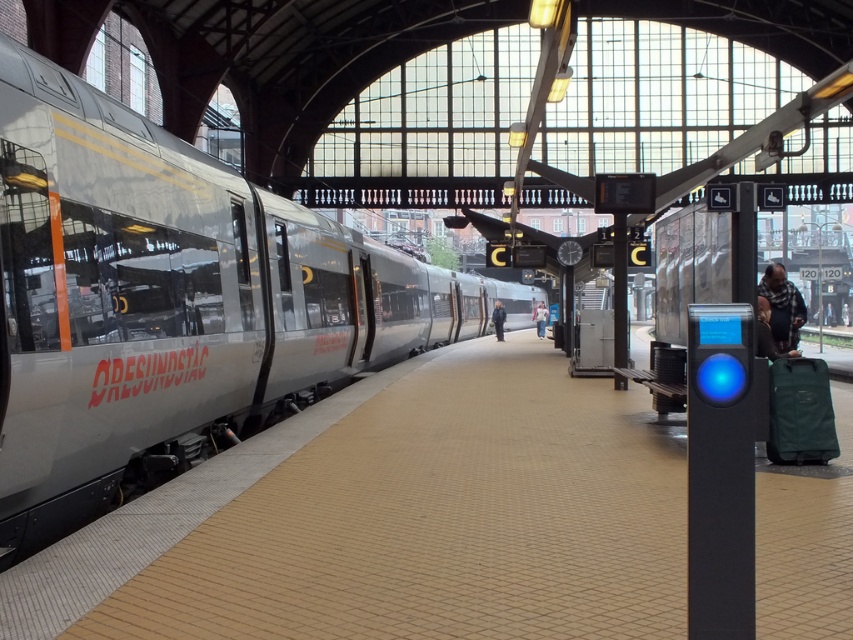
You are a passenger waiting on the train platform and notice two people wearing different colored clothing. The dark blue shirt at right and the light blue denim jacket at center. Which clothing item is positioned lower in the image?

The dark blue shirt at right is below the light blue denim jacket at center, so the dark blue shirt at right is positioned lower in the image.

You are a traveler waiting on the train station platform and notice two items nearby. You see the plaid fabric scarf at right and the light blue denim jacket at center. Which item is shorter in height?

The plaid fabric scarf at right has a lesser height compared to the light blue denim jacket at center, so the plaid fabric scarf at right is shorter in height.

Consider the image. You are a passenger waiting on the platform and see the silver metallic train at left and the dark blue shirt at right. Which object is bigger in size?

The silver metallic train at left is larger in size compared to the dark blue shirt at right.